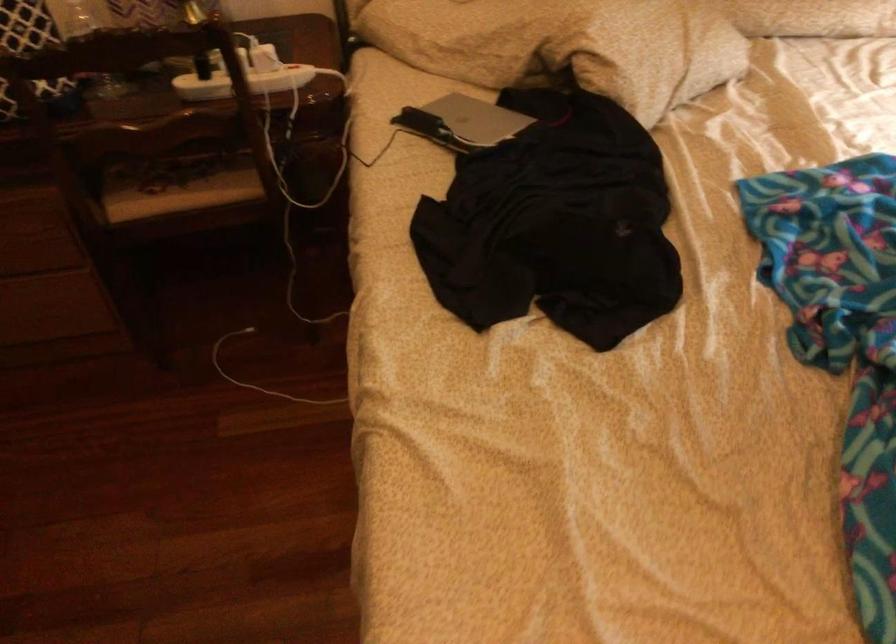
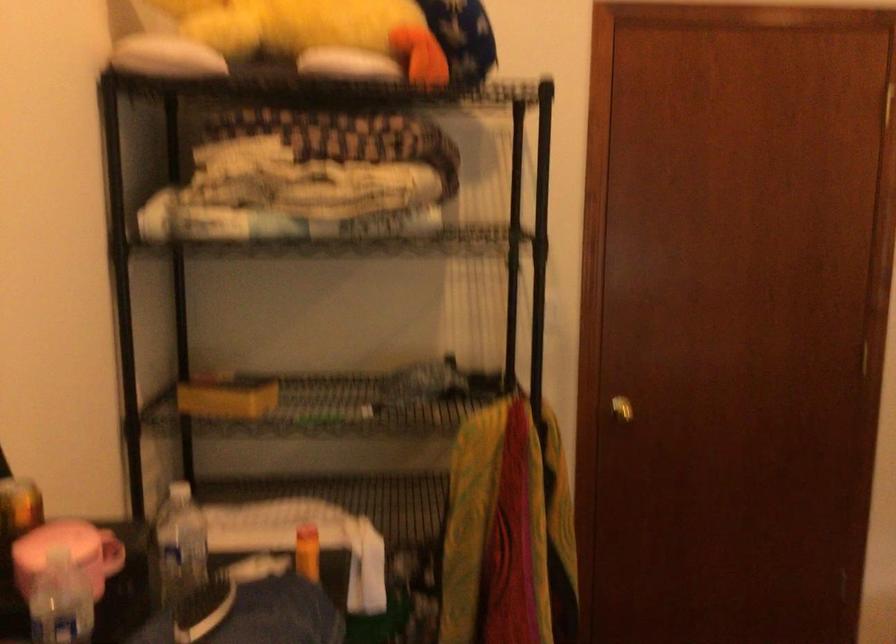
Question: The camera is either moving clockwise (left) or counter-clockwise (right) around the object. The first image is from the beginning of the video and the second image is from the end. Is the camera moving left or right when shooting the video?

Choices:
 (A) Left
 (B) Right

Answer: (B)